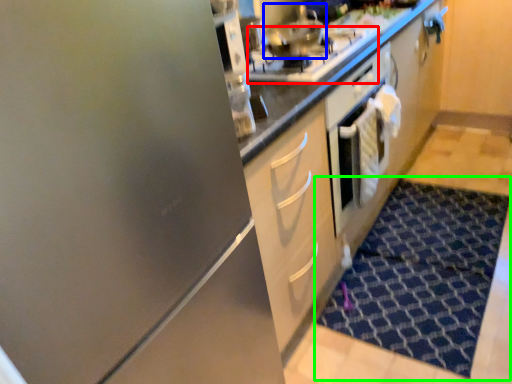
Question: Estimate the real-world distances between objects in this image. Which object is farther from gas stove (highlighted by a red box), stainless steel (highlighted by a blue box) or doormat (highlighted by a green box)?

Choices:
 (A) stainless steel
 (B) doormat

Answer: (B)